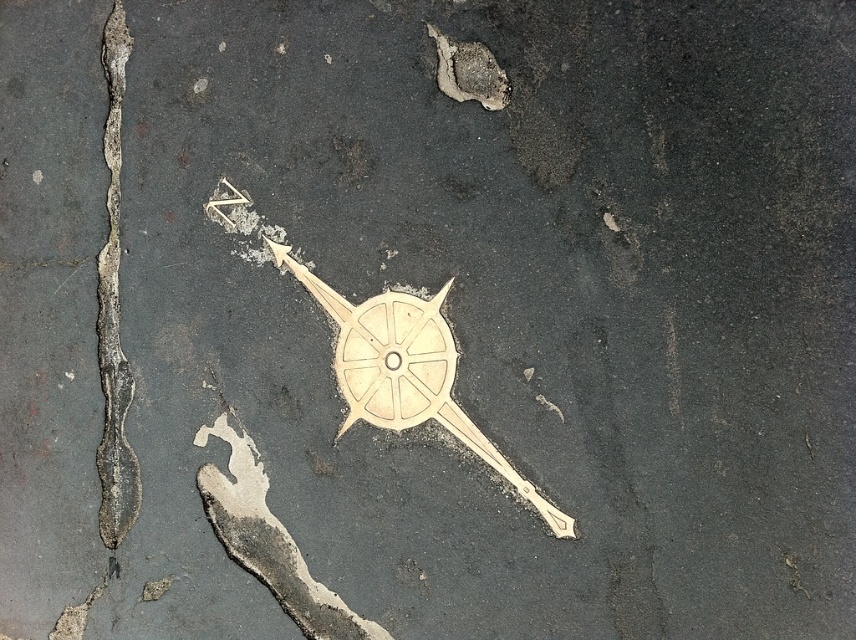
You are a construction worker measuring the width of the white matte compass at center and the dark gray cracked asphalt at left. Which one has a greater width?

The white matte compass at center has a greater width than the dark gray cracked asphalt at left.